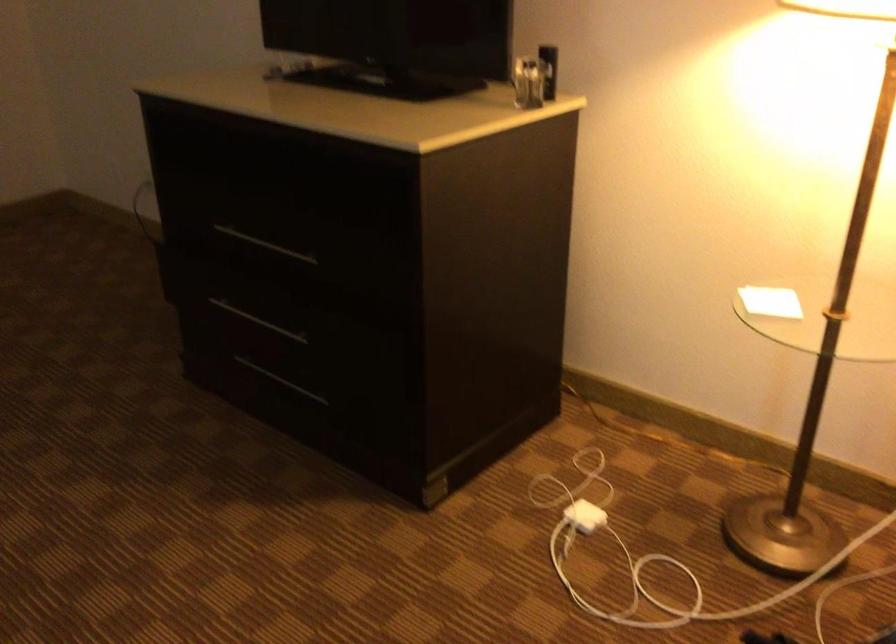
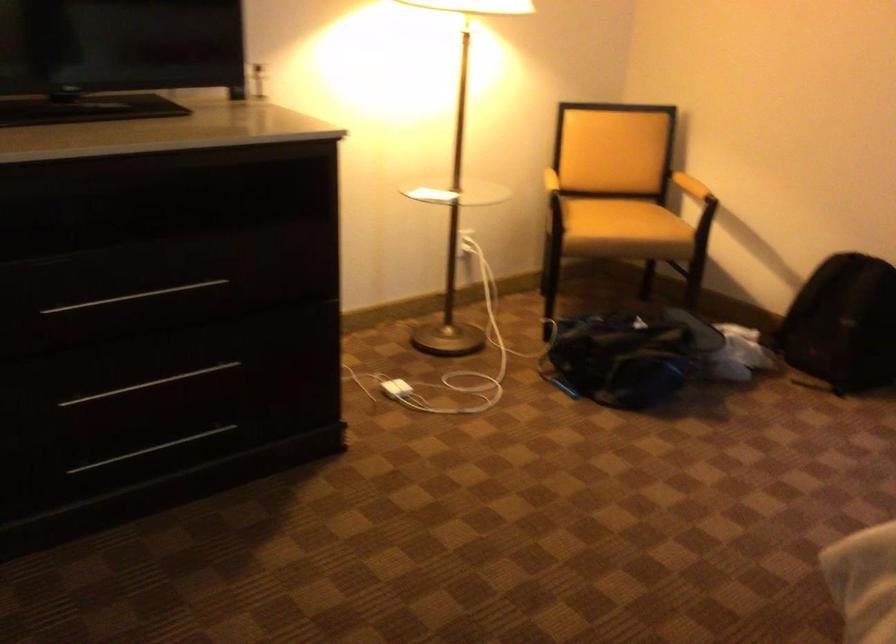
In the second image, find the point that corresponds to pixel 289 382 in the first image.

(151, 449)